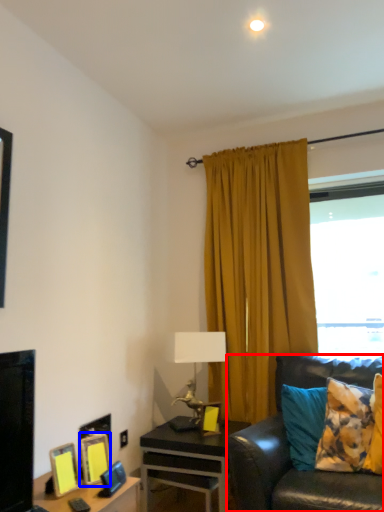
Question: Which point is closer to the camera, studio couch (highlighted by a red box) or picture frame (highlighted by a blue box)?

Choices:
 (A) studio couch
 (B) picture frame

Answer: (A)